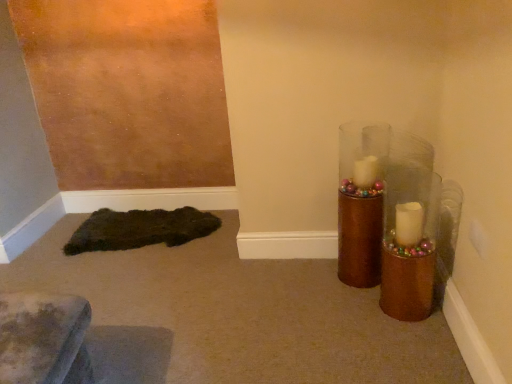
What is the approximate height of dark brown fuzzy rug at lower left?

The height of dark brown fuzzy rug at lower left is 2.92 inches.

What do you see at coordinates (140, 229) in the screenshot? Image resolution: width=512 pixels, height=384 pixels. I see `dark brown fuzzy rug at lower left` at bounding box center [140, 229].

Locate an element on the screen. dark brown fuzzy rug at lower left is located at coordinates pyautogui.click(x=140, y=229).

The height and width of the screenshot is (384, 512). Find the location of `gold metallic candle holder at right`. gold metallic candle holder at right is located at coordinates (359, 240).

Describe the element at coordinates (359, 240) in the screenshot. I see `gold metallic candle holder at right` at that location.

Locate an element on the screen. The image size is (512, 384). dark brown fuzzy rug at lower left is located at coordinates (140, 229).

Is dark brown fuzzy rug at lower left to the left of gold metallic candle holder at right from the viewer's perspective?

Yes.

Between dark brown fuzzy rug at lower left and gold metallic candle holder at right, which one is positioned behind?

dark brown fuzzy rug at lower left is behind.

Which point is more forward, (x=70, y=240) or (x=362, y=263)?

The point (x=362, y=263) is more forward.

From the image's perspective, is dark brown fuzzy rug at lower left beneath gold metallic candle holder at right?

Indeed, from the image's perspective, dark brown fuzzy rug at lower left is shown beneath gold metallic candle holder at right.

From a real-world perspective, which object stands above the other?

In real-world perspective, gold metallic candle holder at right is above.

Considering the sizes of dark brown fuzzy rug at lower left and gold metallic candle holder at right in the image, is dark brown fuzzy rug at lower left wider or thinner than gold metallic candle holder at right?

dark brown fuzzy rug at lower left is wider than gold metallic candle holder at right.

Can you confirm if dark brown fuzzy rug at lower left is shorter than gold metallic candle holder at right?

Correct, dark brown fuzzy rug at lower left is not as tall as gold metallic candle holder at right.

Considering the relative sizes of dark brown fuzzy rug at lower left and gold metallic candle holder at right in the image provided, is dark brown fuzzy rug at lower left smaller than gold metallic candle holder at right?

Yes, dark brown fuzzy rug at lower left is smaller than gold metallic candle holder at right.

Would you say dark brown fuzzy rug at lower left is outside gold metallic candle holder at right?

dark brown fuzzy rug at lower left is positioned outside gold metallic candle holder at right.

Is dark brown fuzzy rug at lower left not close to gold metallic candle holder at right?

Indeed, dark brown fuzzy rug at lower left is not near gold metallic candle holder at right.

Is dark brown fuzzy rug at lower left facing towards gold metallic candle holder at right?

No.

Measure the distance between dark brown fuzzy rug at lower left and gold metallic candle holder at right.

3.82 feet.

What are the coordinates of `candle holder lying above the dark brown fuzzy rug at lower left (from the image's perspective)` in the screenshot? It's located at (359, 240).

Looking at this image, considering the positions of objects gold metallic candle holder at right and dark brown fuzzy rug at lower left in the image provided, who is more to the left, gold metallic candle holder at right or dark brown fuzzy rug at lower left?

dark brown fuzzy rug at lower left is more to the left.

Is gold metallic candle holder at right positioned in front of dark brown fuzzy rug at lower left?

That is True.

Which point is more forward, (x=361, y=270) or (x=199, y=212)?

The point (x=361, y=270) is in front.

From the image's perspective, who appears lower, gold metallic candle holder at right or dark brown fuzzy rug at lower left?

dark brown fuzzy rug at lower left appears lower in the image.

From a real-world perspective, who is located lower, gold metallic candle holder at right or dark brown fuzzy rug at lower left?

In real-world perspective, dark brown fuzzy rug at lower left is lower.

Between gold metallic candle holder at right and dark brown fuzzy rug at lower left, which one has larger width?

With larger width is dark brown fuzzy rug at lower left.

Is gold metallic candle holder at right taller or shorter than dark brown fuzzy rug at lower left?

gold metallic candle holder at right is taller than dark brown fuzzy rug at lower left.

Can you confirm if gold metallic candle holder at right is bigger than dark brown fuzzy rug at lower left?

Correct, gold metallic candle holder at right is larger in size than dark brown fuzzy rug at lower left.

Based on the photo, would you say gold metallic candle holder at right is outside dark brown fuzzy rug at lower left?

gold metallic candle holder at right lies outside dark brown fuzzy rug at lower left's area.

Is gold metallic candle holder at right far from dark brown fuzzy rug at lower left?

Absolutely, gold metallic candle holder at right is distant from dark brown fuzzy rug at lower left.

Is gold metallic candle holder at right aimed at dark brown fuzzy rug at lower left?

No.

How different are the orientations of gold metallic candle holder at right and dark brown fuzzy rug at lower left in degrees?

gold metallic candle holder at right and dark brown fuzzy rug at lower left are facing 5.68 degrees away from each other.

Identify the location of mat directly beneath the gold metallic candle holder at right (from a real-world perspective). The width and height of the screenshot is (512, 384). (140, 229).

Find the location of a particular element. The height and width of the screenshot is (384, 512). mat directly beneath the gold metallic candle holder at right (from a real-world perspective) is located at coordinates (140, 229).

Where is `mat located behind the gold metallic candle holder at right`? The image size is (512, 384). mat located behind the gold metallic candle holder at right is located at coordinates (140, 229).